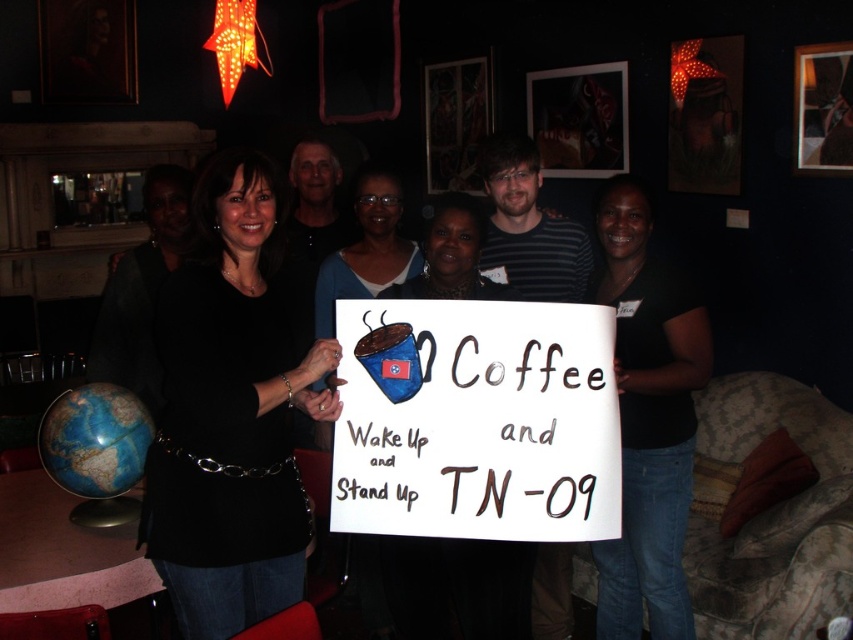
Question: Is black fabric shirt at center closer to the viewer compared to blue fabric mug at center?

Choices:
 (A) no
 (B) yes

Answer: (B)

Question: Observing the image, what is the correct spatial positioning of white paper sign at center in reference to black matte shirt at center?

Choices:
 (A) left
 (B) right

Answer: (B)

Question: Is white paper sign at center thinner than blue fabric mug at center?

Choices:
 (A) yes
 (B) no

Answer: (B)

Question: Which of the following is the farthest from the observer?

Choices:
 (A) white paper sign at center
 (B) blue fabric mug at center
 (C) black matte shirt at center
 (D) black fabric shirt at center

Answer: (B)

Question: Which point is closer to the camera?

Choices:
 (A) black fabric shirt at center
 (B) blue fabric mug at center
 (C) black matte shirt at center

Answer: (C)

Question: Which object is the closest to the black matte shirt at center?

Choices:
 (A) black fabric shirt at center
 (B) white paper sign at center
 (C) blue fabric mug at center

Answer: (B)